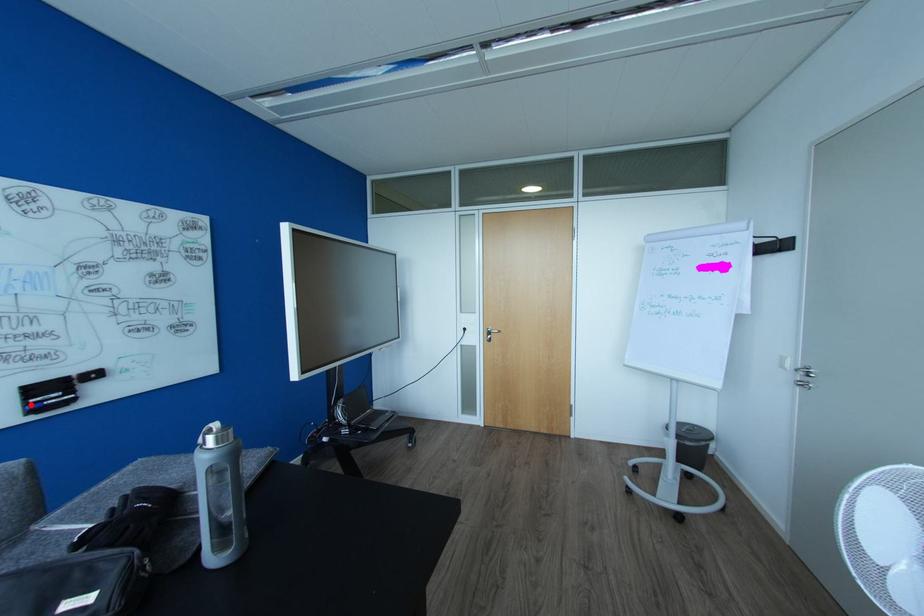
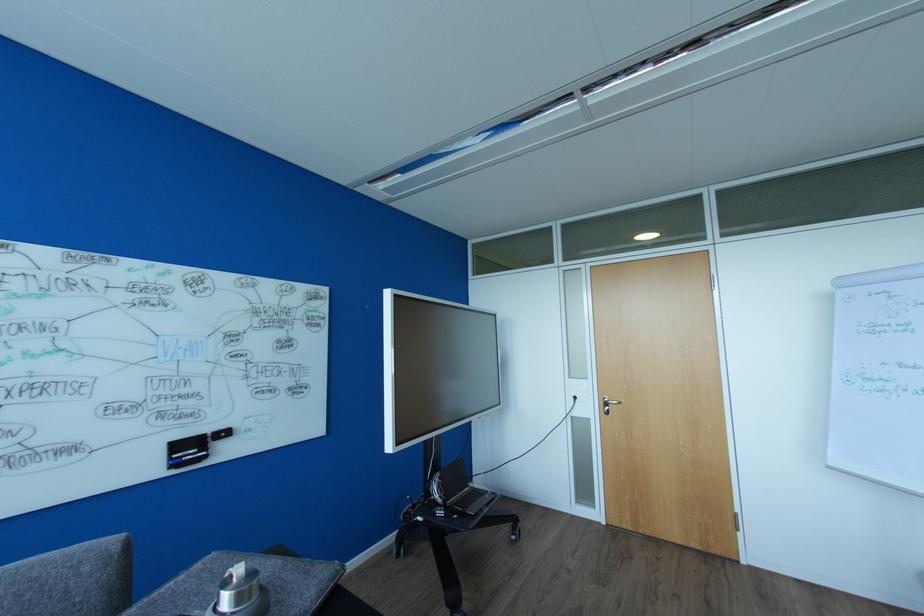
Locate, in the second image, the point that corresponds to the highlighted location in the first image.

(175, 460)